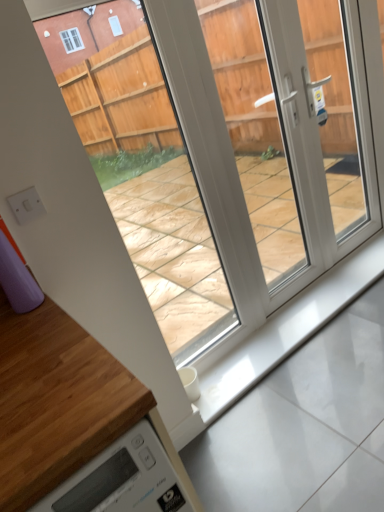
Question: Considering the relative positions of transparent plastic glass door at center and wooden at lower left in the image provided, is transparent plastic glass door at center to the right of wooden at lower left from the viewer's perspective?

Choices:
 (A) yes
 (B) no

Answer: (A)

Question: Does transparent plastic glass door at center have a greater height compared to wooden at lower left?

Choices:
 (A) no
 (B) yes

Answer: (B)

Question: Does transparent plastic glass door at center have a larger size compared to wooden at lower left?

Choices:
 (A) yes
 (B) no

Answer: (B)

Question: Considering the relative sizes of transparent plastic glass door at center and wooden at lower left in the image provided, is transparent plastic glass door at center wider than wooden at lower left?

Choices:
 (A) yes
 (B) no

Answer: (B)

Question: Is transparent plastic glass door at center at the left side of wooden at lower left?

Choices:
 (A) yes
 (B) no

Answer: (B)

Question: Considering the positions of wooden at lower left and white glossy concrete at bottom in the image, is wooden at lower left bigger or smaller than white glossy concrete at bottom?

Choices:
 (A) big
 (B) small

Answer: (A)

Question: From the image's perspective, is wooden at lower left located above or below white glossy concrete at bottom?

Choices:
 (A) below
 (B) above

Answer: (A)

Question: Based on their positions, is wooden at lower left located to the left or right of white glossy concrete at bottom?

Choices:
 (A) right
 (B) left

Answer: (B)

Question: Does point (23, 320) appear closer or farther from the camera than point (225, 419)?

Choices:
 (A) farther
 (B) closer

Answer: (B)

Question: From the image's perspective, is white glossy concrete at bottom positioned above or below transparent plastic glass door at center?

Choices:
 (A) below
 (B) above

Answer: (A)

Question: Looking at their shapes, would you say white glossy concrete at bottom is wider or thinner than transparent plastic glass door at center?

Choices:
 (A) wide
 (B) thin

Answer: (A)

Question: From a real-world perspective, is white glossy concrete at bottom above or below transparent plastic glass door at center?

Choices:
 (A) below
 (B) above

Answer: (A)

Question: Is point (296, 411) closer or farther from the camera than point (117, 136)?

Choices:
 (A) farther
 (B) closer

Answer: (B)

Question: From their relative heights in the image, would you say wooden at lower left is taller or shorter than transparent plastic glass door at center?

Choices:
 (A) short
 (B) tall

Answer: (A)

Question: In terms of width, does wooden at lower left look wider or thinner when compared to transparent plastic glass door at center?

Choices:
 (A) wide
 (B) thin

Answer: (A)